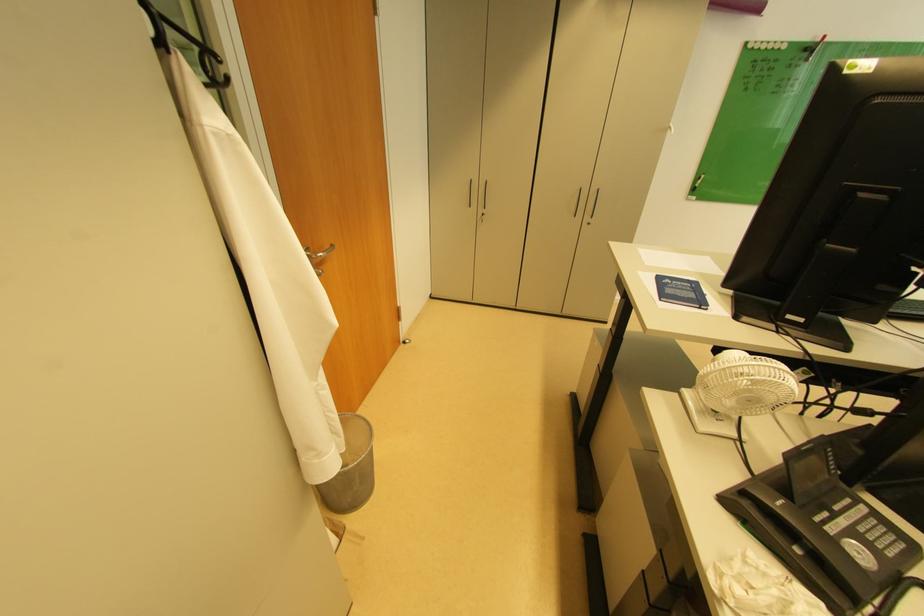
At what (x,y) coordinates should I click in order to perform the action: click on black coat hook. Please return your answer as a coordinate pair (x, y). The image size is (924, 616). Looking at the image, I should click on (213, 70).